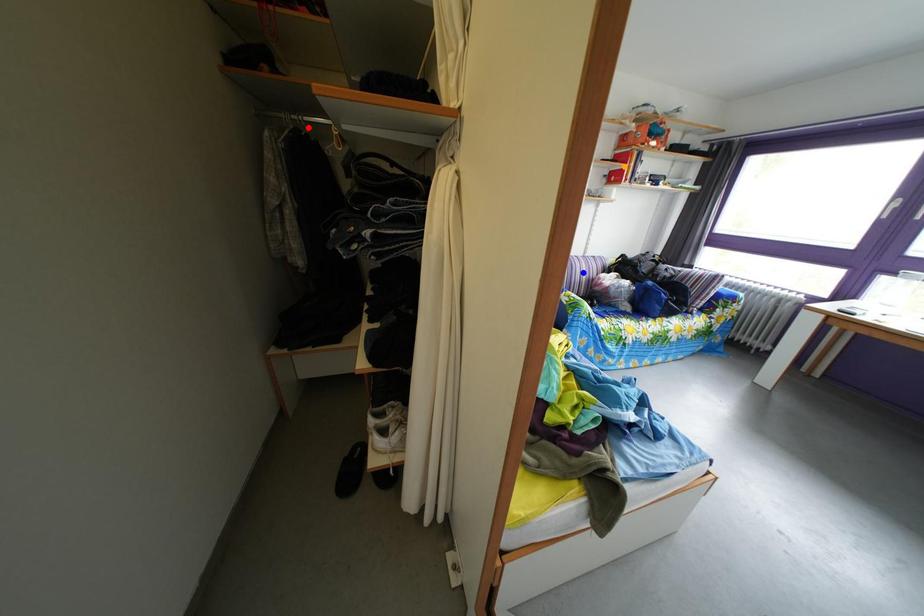
Order these from nearest to farthest:
1. orange point
2. blue point
3. red point

1. blue point
2. red point
3. orange point